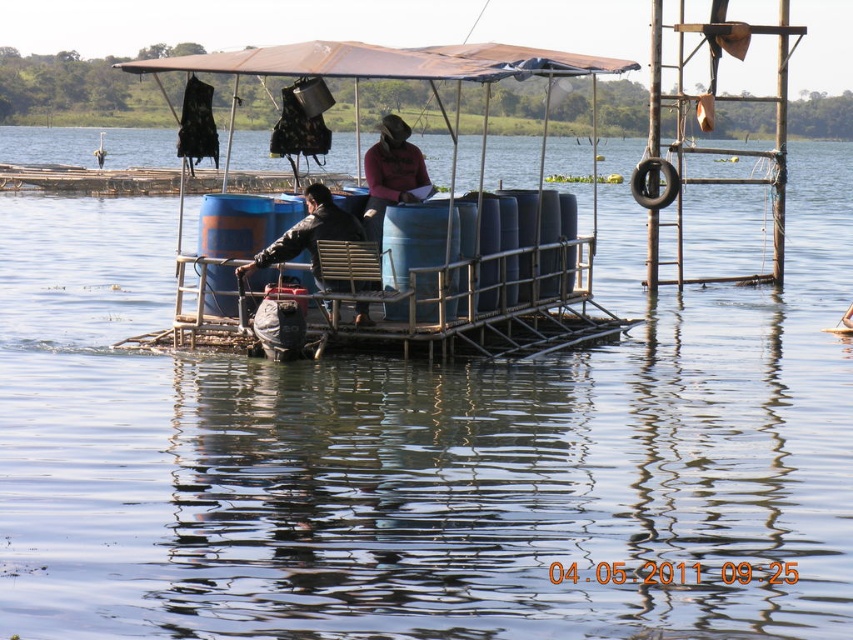
You are a passenger on the raft and want to move from the blue plastic barrels at center to the leather jacket at center. Which direction should you move to reach the jacket?

The blue plastic barrels at center is to the left of leather jacket at center, so you should move to the right to reach the jacket.

You are on a boat approaching the raft and need to identify the person wearing the leather jacket at center and the matte pink shirt at center. Which one is closer to you?

The leather jacket at center is closer to you than the matte pink shirt at center.

You are planning to build a similar raft and need to ensure that the blue plastic barrels at center will not block the view of someone wearing the matte pink shirt at center. Based on the image, can you determine if the barrels are taller than the shirt?

The blue plastic barrels at center are taller than the matte pink shirt at center, so they would block the view of the person wearing the matte pink shirt at center.